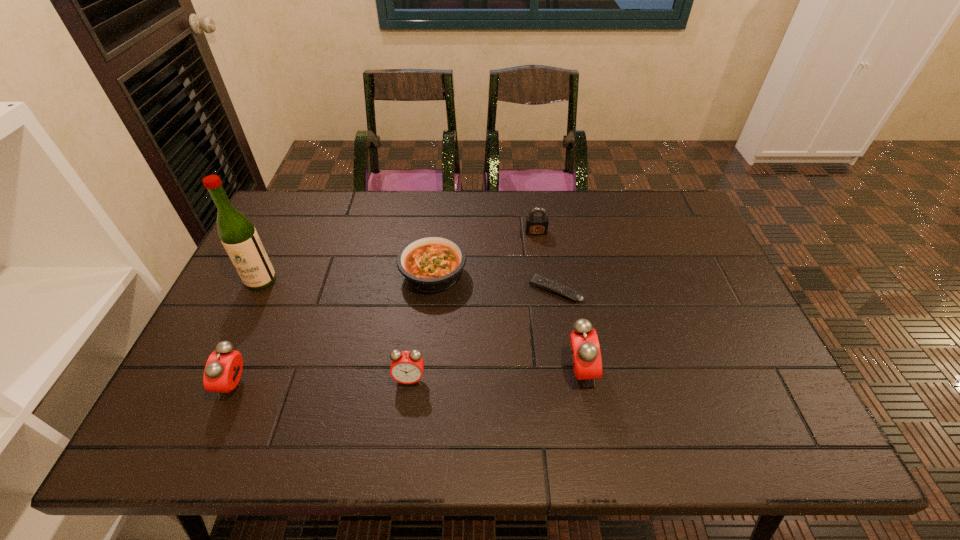
The height and width of the screenshot is (540, 960). Identify the location of vacant space situated 0.070m on the front-facing side of the second tallest object. [x=624, y=372].

You are a GUI agent. You are given a task and a screenshot of the screen. Output one action in this format:
    pyautogui.click(x=<x>, y=<y>)
    Task: Click on the vacant region located on the front of the farthest object near the keyhole
    The image size is (960, 540).
    Given the screenshot: What is the action you would take?
    click(x=540, y=267)

This screenshot has width=960, height=540. Find the location of `vacant space located on the back of the stew`. vacant space located on the back of the stew is located at coordinates [x=438, y=232].

Locate an element on the screen. vacant space situated 0.060m on the label of the liquor is located at coordinates (248, 307).

Locate an element on the screen. vacant space situated on the back of the shortest object is located at coordinates (550, 260).

This screenshot has height=540, width=960. I want to click on object present at the far edge, so click(x=535, y=225).

The width and height of the screenshot is (960, 540). I want to click on alarm clock that is at the left edge, so click(223, 369).

The width and height of the screenshot is (960, 540). Identify the location of liquor situated at the left edge. (x=239, y=237).

At what (x,y) coordinates should I click in order to perform the action: click on object that is at the near left corner. Please return your answer as a coordinate pair (x, y). The image size is (960, 540). Looking at the image, I should click on (223, 369).

Identify the location of free spot at the far edge of the desktop. (474, 228).